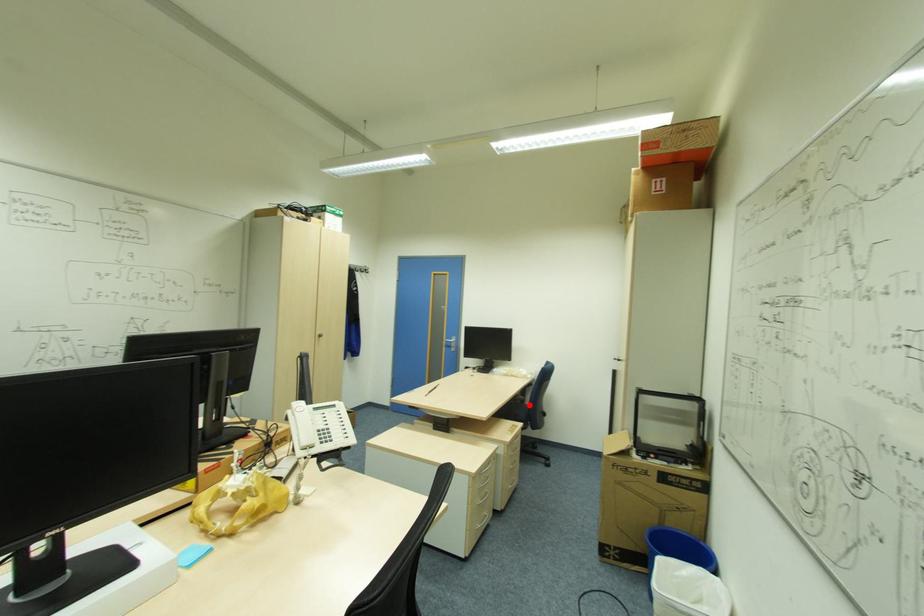
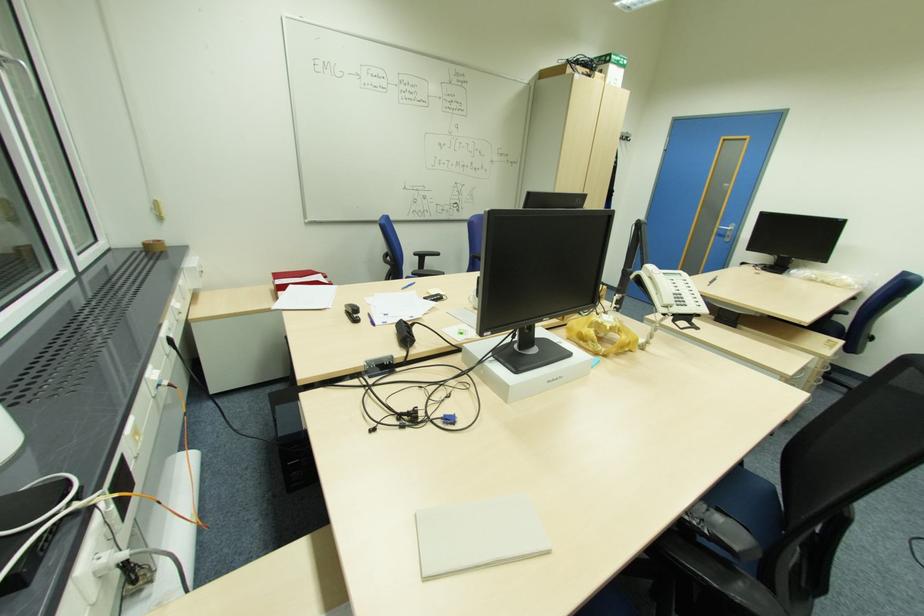
Where in the second image is the point corresponding to the highlighted location from the first image?

(839, 322)